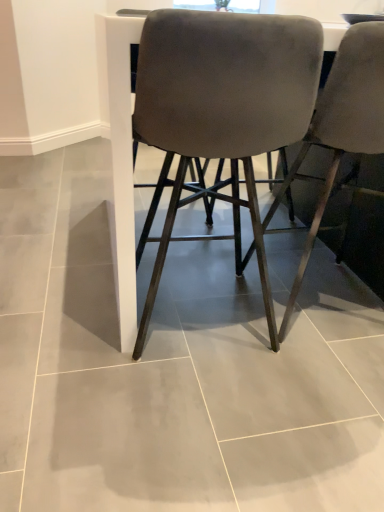
Question: Is suede-like gray chair at center, positioned as the first chair in left-to-right order, to the left or to the right of velvet gray chair at center, which is counted as the 2th chair, starting from the left, in the image?

Choices:
 (A) left
 (B) right

Answer: (A)

Question: From a real-world perspective, is suede-like gray chair at center, positioned as the first chair in left-to-right order, above or below velvet gray chair at center, which is counted as the 2th chair, starting from the left?

Choices:
 (A) below
 (B) above

Answer: (A)

Question: From the image's perspective, is suede-like gray chair at center, positioned as the first chair in left-to-right order, located above or below velvet gray chair at center, which ranks as the 1th chair in right-to-left order?

Choices:
 (A) below
 (B) above

Answer: (A)

Question: Do you think velvet gray chair at center, which is counted as the 2th chair, starting from the left, is within suede-like gray chair at center, positioned as the first chair in left-to-right order, or outside of it?

Choices:
 (A) outside
 (B) inside

Answer: (A)

Question: Does point (296, 293) appear closer or farther from the camera than point (185, 88)?

Choices:
 (A) farther
 (B) closer

Answer: (A)

Question: From the image's perspective, is velvet gray chair at center, which is counted as the 2th chair, starting from the left, located above or below suede-like gray chair at center, which is the second chair in right-to-left order?

Choices:
 (A) above
 (B) below

Answer: (A)

Question: Considering the relative positions of velvet gray chair at center, which ranks as the 1th chair in right-to-left order, and suede-like gray chair at center, positioned as the first chair in left-to-right order, in the image provided, is velvet gray chair at center, which ranks as the 1th chair in right-to-left order, to the left or to the right of suede-like gray chair at center, positioned as the first chair in left-to-right order,?

Choices:
 (A) left
 (B) right

Answer: (B)